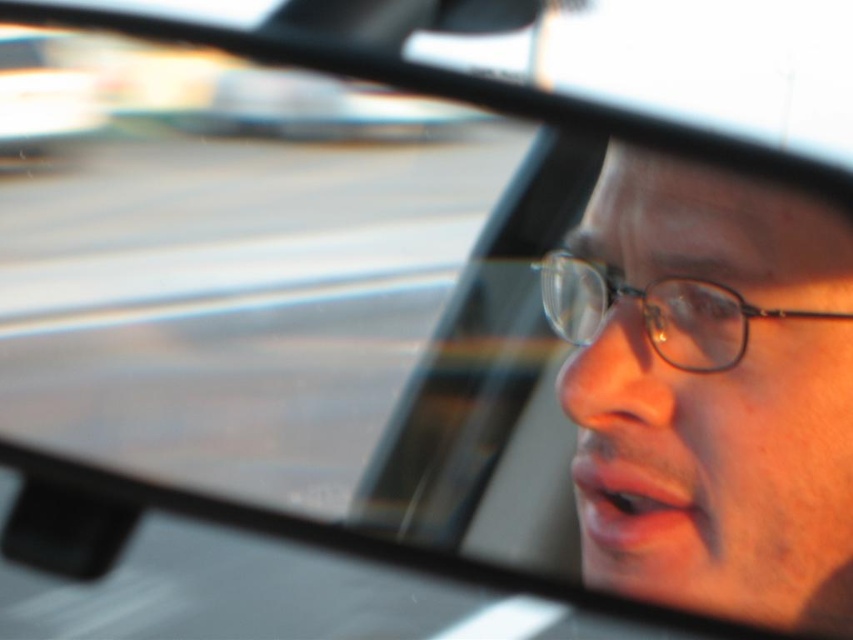
You are a passenger in the car and notice two pairs of clear plastic glasses in the image. Which pair is taller, the clear plastic glasses at right or the clear plastic glasses at center?

The clear plastic glasses at right is much taller as clear plastic glasses at center.

You are a passenger in the car and want to know where the clear plastic glasses at right are located in the mirror. Can you describe their position using coordinates?

The clear plastic glasses at right are located at coordinates point (709, 392) in the mirror.